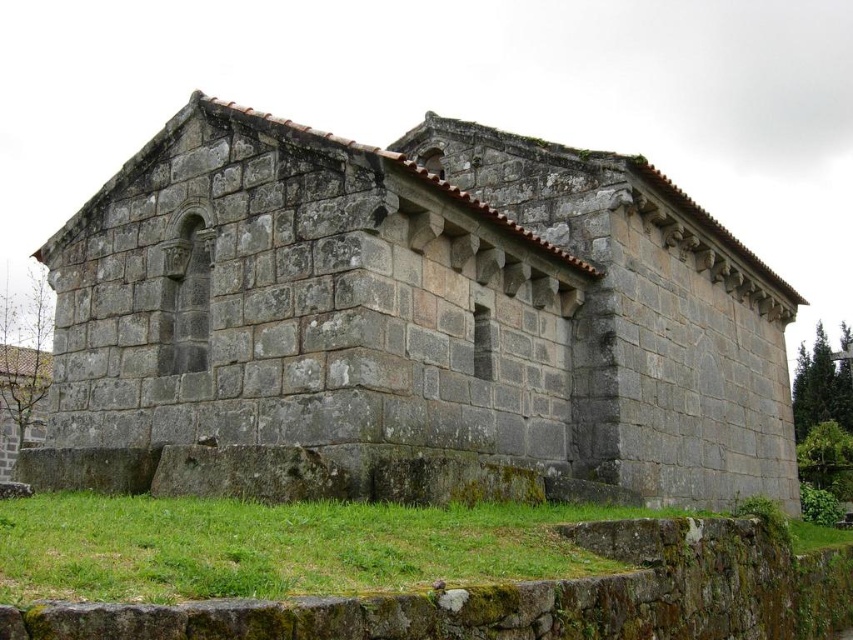
In the scene shown: You are standing in front of the gray stone church at center and notice the green mossy stone at lower center nearby. Which object is taller?

The gray stone church at center is taller than the green mossy stone at lower center.

You are standing in a park and see the gray stone church at center. If you want to take a photo of the church from the exact center point, where should you position your camera?

The gray stone church at center is located at the coordinates point (x=421, y=307), so you should position your camera at that point to capture the exact center.